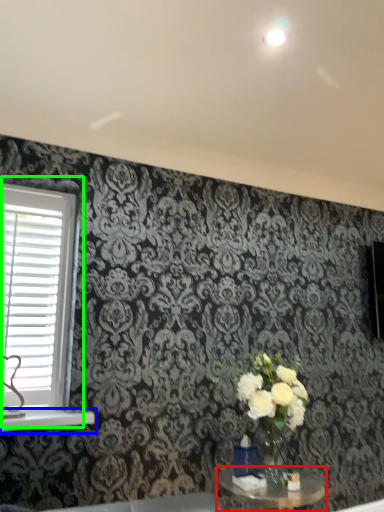
Question: Based on their relative distances, which object is farther from table (highlighted by a red box)? Choose from window sill (highlighted by a blue box) and window (highlighted by a green box).

Choices:
 (A) window sill
 (B) window

Answer: (B)